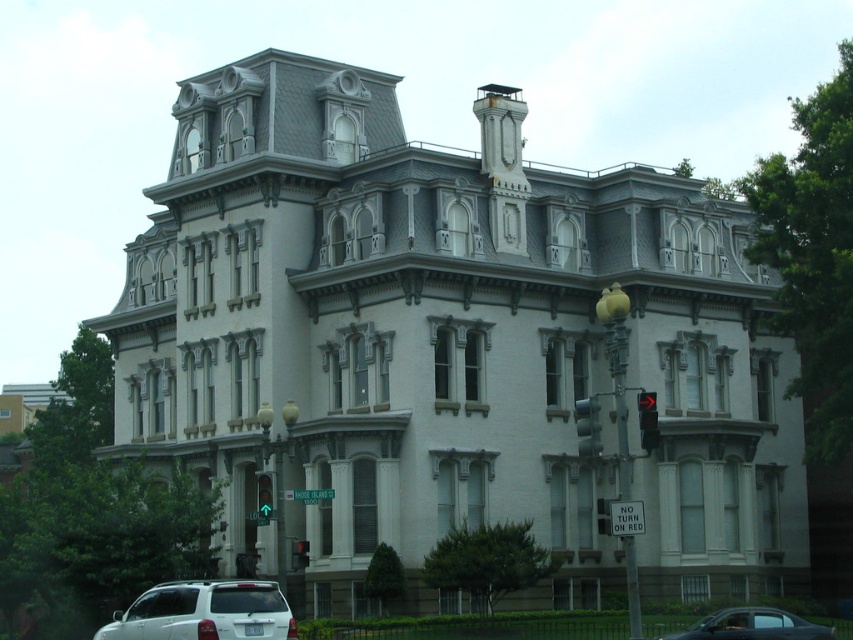
You are a driver approaching the intersection near the Victorian building. You see the black glass traffic light at right and the green glass traffic light at lower left. Which traffic light is positioned further to the right side of the scene?

The black glass traffic light at right is positioned to the right of the green glass traffic light at lower left, so it is further to the right side of the scene.

You are a driver approaching the intersection near the Victorian building. You see the metallic gray sedan at lower right and the black glass traffic light at right. The traffic light is red. Can you turn right here?

The black glass traffic light at right is red and the sign says No Turn On Red, so you cannot turn right here.